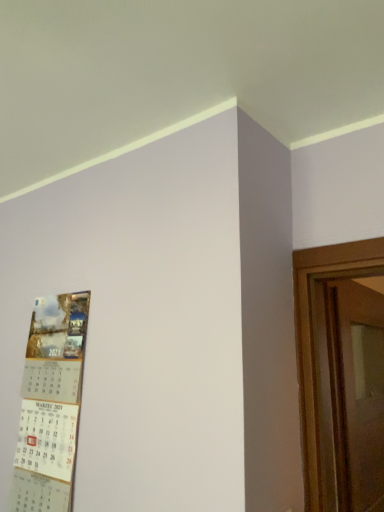
Question: From the image's perspective, is matte paper calendar at left on top of wooden door at right?

Choices:
 (A) yes
 (B) no

Answer: (A)

Question: From a real-world perspective, is matte paper calendar at left below wooden door at right?

Choices:
 (A) no
 (B) yes

Answer: (A)

Question: From the image's perspective, is matte paper calendar at left below wooden door at right?

Choices:
 (A) no
 (B) yes

Answer: (A)

Question: Does matte paper calendar at left touch wooden door at right?

Choices:
 (A) no
 (B) yes

Answer: (A)

Question: Can you confirm if matte paper calendar at left is shorter than wooden door at right?

Choices:
 (A) no
 (B) yes

Answer: (B)

Question: Is matte paper calendar at left in front of wooden door at right?

Choices:
 (A) yes
 (B) no

Answer: (A)

Question: Is matte paper calendar at left completely or partially inside wooden door at right?

Choices:
 (A) yes
 (B) no

Answer: (B)

Question: Does wooden door at right have a greater height compared to matte paper calendar at left?

Choices:
 (A) yes
 (B) no

Answer: (A)

Question: Is wooden door at right at the left side of matte paper calendar at left?

Choices:
 (A) yes
 (B) no

Answer: (B)

Question: Is wooden door at right to the right of matte paper calendar at left from the viewer's perspective?

Choices:
 (A) no
 (B) yes

Answer: (B)

Question: Does wooden door at right have a larger size compared to matte paper calendar at left?

Choices:
 (A) yes
 (B) no

Answer: (A)

Question: Is wooden door at right not close to matte paper calendar at left?

Choices:
 (A) no
 (B) yes

Answer: (A)

Question: In terms of height, does matte paper calendar at left look taller or shorter compared to wooden door at right?

Choices:
 (A) short
 (B) tall

Answer: (A)